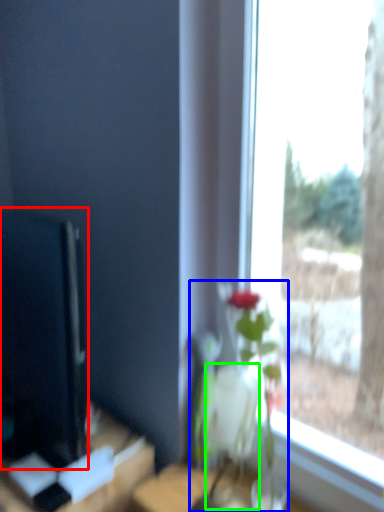
Question: Which object is positioned farthest from computer monitor (highlighted by a red box)? Select from houseplant (highlighted by a blue box) and vase (highlighted by a green box).

Choices:
 (A) houseplant
 (B) vase

Answer: (B)